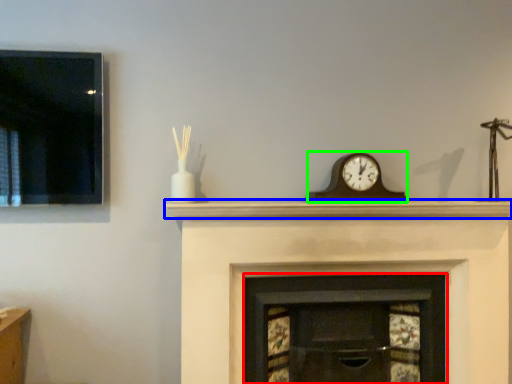
Question: Which object is the farthest from fireplace (highlighted by a red box)? Choose among these: mantle (highlighted by a blue box) or wall clock (highlighted by a green box).

Choices:
 (A) mantle
 (B) wall clock

Answer: (B)